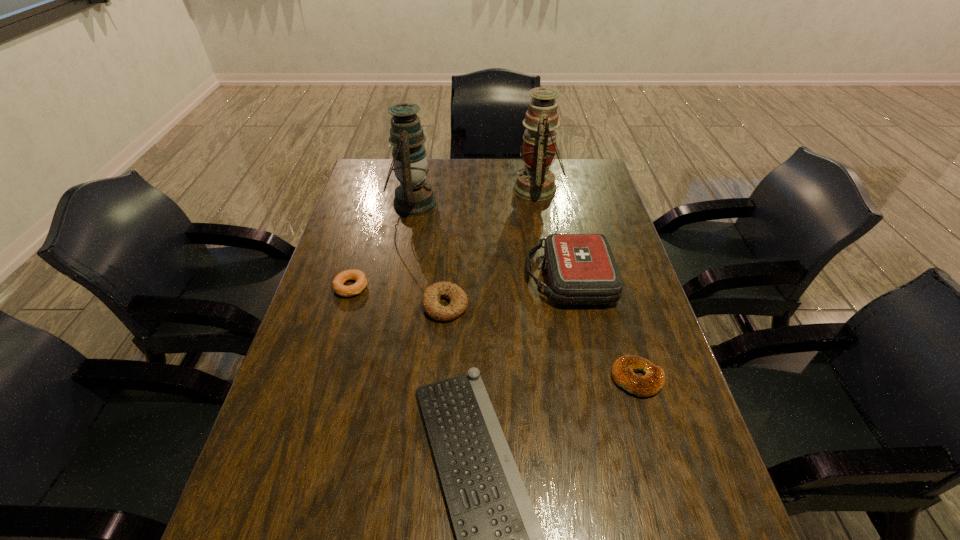
This screenshot has height=540, width=960. In order to click on the right oil lamp in this screenshot , I will do `click(535, 182)`.

Identify the location of the left oil lamp. tap(413, 197).

Where is `the fifth shortest object`? the fifth shortest object is located at coordinates (581, 268).

Find the location of a particular element. The height and width of the screenshot is (540, 960). the second bagel from left to right is located at coordinates (431, 297).

The height and width of the screenshot is (540, 960). In order to click on the nearest bagel in this screenshot , I will do `click(623, 369)`.

This screenshot has height=540, width=960. What are the coordinates of `the leftmost bagel` in the screenshot? It's located at (361, 281).

The width and height of the screenshot is (960, 540). I want to click on free spot located 0.250m on the front of the right oil lamp, so [x=549, y=255].

In order to click on free space located 0.300m on the right of the left oil lamp in this screenshot , I will do `click(522, 204)`.

Locate an element on the screen. Image resolution: width=960 pixels, height=540 pixels. vacant area situated on the front of the fifth shortest object is located at coordinates (593, 393).

The height and width of the screenshot is (540, 960). In order to click on vacant space situated on the right of the second bagel from right to left in this screenshot , I will do `click(596, 306)`.